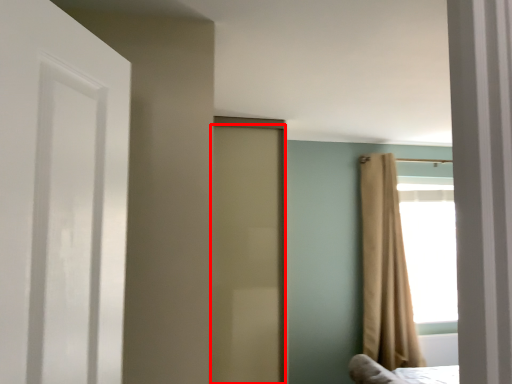
Question: Where is door (annotated by the red box) located in relation to curtain in the image?

Choices:
 (A) right
 (B) left

Answer: (B)